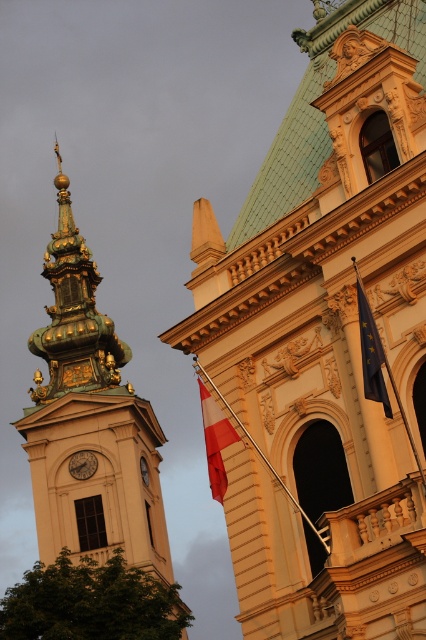
Question: Considering the real-world distances, which object is closest to the gold/gilded metal clock tower at left?

Choices:
 (A) blue fabric flag at center-right
 (B) golden ornate tower at upper left

Answer: (B)

Question: Does white fabric flag at center have a smaller size compared to wooden clock at left?

Choices:
 (A) yes
 (B) no

Answer: (B)

Question: Which point is farther from the camera taking this photo?

Choices:
 (A) (37, 397)
 (B) (377, 337)
 (C) (81, 474)
 (D) (359, 108)

Answer: (A)

Question: Does gold/gilded metal clock tower at left have a larger size compared to blue fabric flag at center-right?

Choices:
 (A) no
 (B) yes

Answer: (B)

Question: Can you confirm if gold/gilded metal clock tower at left is smaller than white fabric flag at center?

Choices:
 (A) no
 (B) yes

Answer: (A)

Question: Among these objects, which one is nearest to the camera?

Choices:
 (A) white fabric flag at center
 (B) wooden clock at left
 (C) gold/gilded metal clock tower at left

Answer: (A)